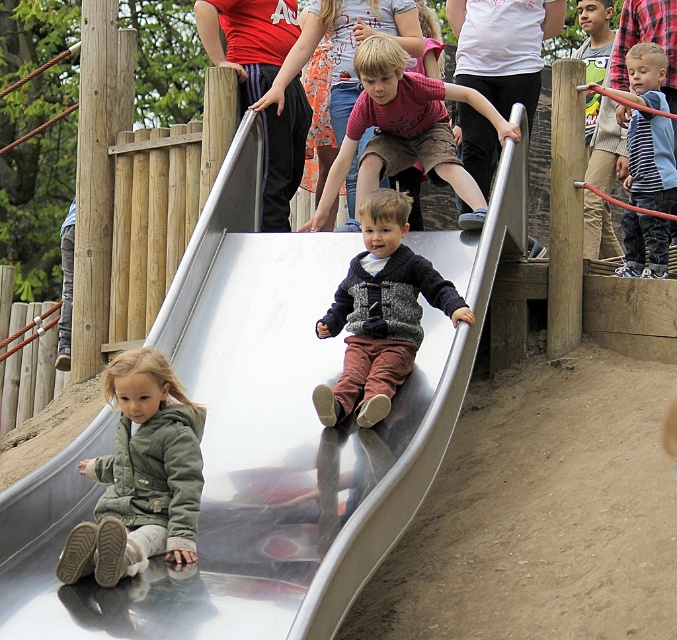
You are a photographer trying to capture a clear shot of both the green fleece jacket at lower left and the knitted sweater at center without any obstruction. Based on the scene description, can you position yourself in a way that both subjects are visible and unobstructed?

The green fleece jacket at lower left is in front of the knitted sweater at center, so positioning yourself behind the green fleece jacket at lower left would allow you to see both subjects without obstruction.

You are a photographer trying to capture a photo of the green fleece jacket at lower left and the matte red shirt at center. Which object should you focus on if you want to include both in the frame without zooming in?

The green fleece jacket at lower left is taller than the matte red shirt at center, so you should focus on the green fleece jacket at lower left to ensure both are visible in the frame without zooming in.